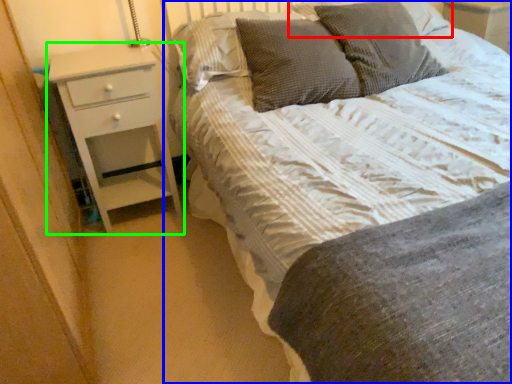
Question: Which object is the farthest from pillow (highlighted by a red box)? Choose among these: bed (highlighted by a blue box) or chest of drawers (highlighted by a green box).

Choices:
 (A) bed
 (B) chest of drawers

Answer: (B)